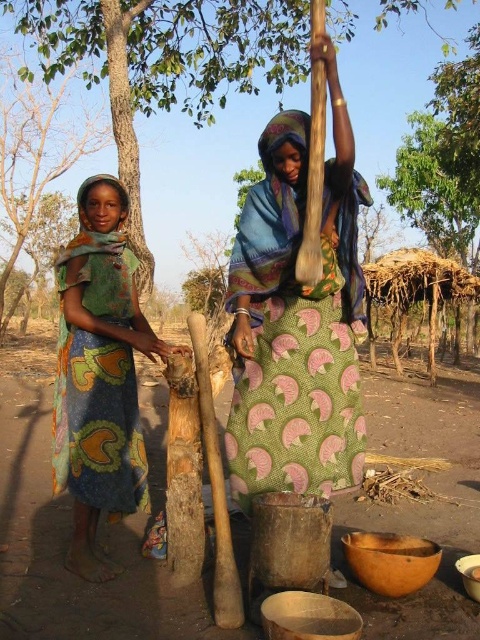
You are standing at point [62,140] and want to walk to the woman grinding in the mortar. Is point [109,38] on your path?

Yes, point [109,38] is on your path because it is in front of point [62,140], so walking towards the woman would pass through it.

You are standing in the rural area shown in the image and want to find shade. Which tree would provide more coverage, the green leafy tree at center or the green leafy tree at left?

The green leafy tree at center is positioned over the green leafy tree at left, meaning it is larger and provides more shade coverage.